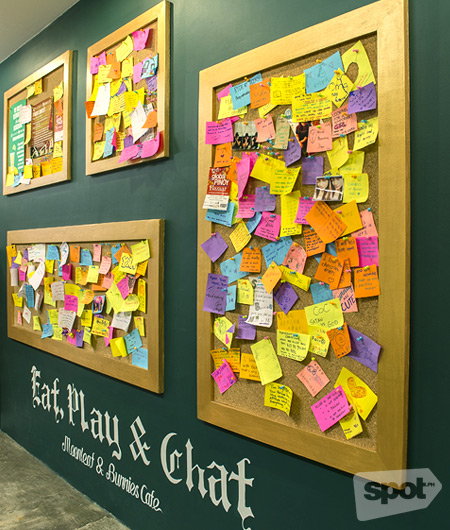
You are a GUI agent. You are given a task and a screenshot of the screen. Output one action in this format:
    pyautogui.click(x=<x>, y=<y>)
    Task: Click on the bulletin board
    Image resolution: width=450 pixels, height=530 pixels.
    Given the screenshot: What is the action you would take?
    pyautogui.click(x=61, y=178), pyautogui.click(x=103, y=160), pyautogui.click(x=204, y=394), pyautogui.click(x=150, y=378)